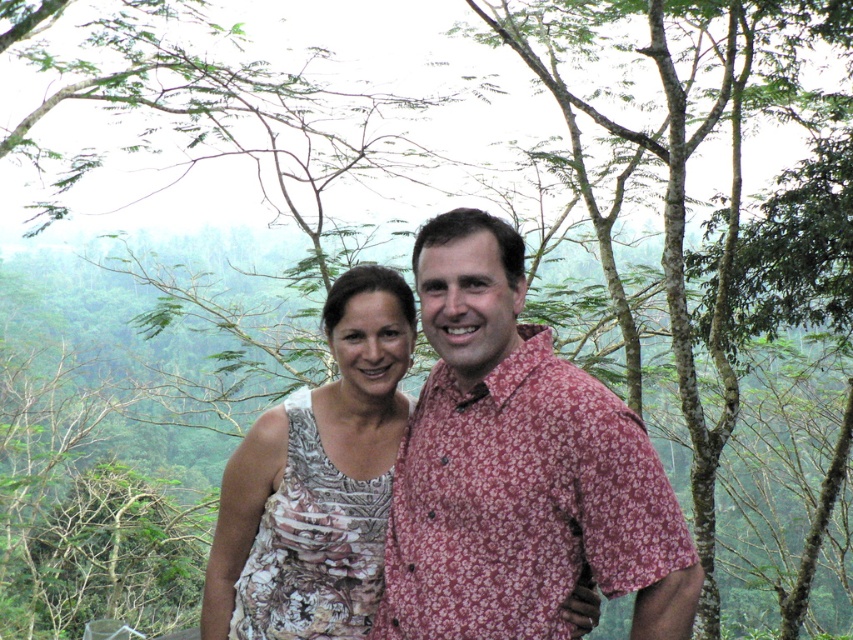
You are standing in a forest and want to reach a specific location marked by the point at coordinates (440, 506). If you can walk 12 feet in a straight line, will you be able to reach that point?

The point at coordinates (440, 506) is 10.84 feet away from the viewer. Since you can walk 12 feet in a straight line, you will be able to reach that point as 12 feet is greater than 10.84 feet.